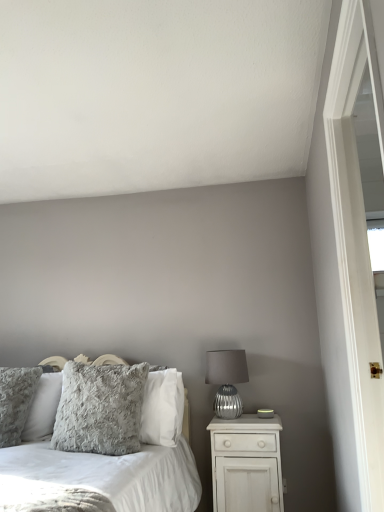
Question: Does fluffy gray pillow at left, arranged as the second pillow when viewed from the right, turn towards matte silver glass table lamp at right?

Choices:
 (A) yes
 (B) no

Answer: (B)

Question: Is the position of fluffy gray pillow at left, arranged as the second pillow when viewed from the right, less distant than that of matte silver glass table lamp at right?

Choices:
 (A) no
 (B) yes

Answer: (B)

Question: Does fluffy gray pillow at left, arranged as the second pillow when viewed from the right, have a larger size compared to matte silver glass table lamp at right?

Choices:
 (A) yes
 (B) no

Answer: (A)

Question: Is matte silver glass table lamp at right surrounded by fluffy gray pillow at left, arranged as the second pillow when viewed from the right?

Choices:
 (A) yes
 (B) no

Answer: (B)

Question: Does fluffy gray pillow at left, which is counted as the 1th pillow, starting from the left, come behind matte silver glass table lamp at right?

Choices:
 (A) yes
 (B) no

Answer: (B)

Question: Considering the relative sizes of fluffy gray pillow at left, which is counted as the 1th pillow, starting from the left, and matte silver glass table lamp at right in the image provided, is fluffy gray pillow at left, which is counted as the 1th pillow, starting from the left, thinner than matte silver glass table lamp at right?

Choices:
 (A) no
 (B) yes

Answer: (B)

Question: Is matte silver glass table lamp at right closer to camera compared to fluffy gray pillow at left, arranged as the second pillow when viewed from the right?

Choices:
 (A) yes
 (B) no

Answer: (B)

Question: Is matte silver glass table lamp at right positioned behind fluffy gray pillow at left, which is counted as the 1th pillow, starting from the left?

Choices:
 (A) yes
 (B) no

Answer: (A)

Question: Is matte silver glass table lamp at right thinner than fluffy gray pillow at left, which is counted as the 1th pillow, starting from the left?

Choices:
 (A) yes
 (B) no

Answer: (B)

Question: Can you confirm if matte silver glass table lamp at right is bigger than fluffy gray pillow at left, arranged as the second pillow when viewed from the right?

Choices:
 (A) no
 (B) yes

Answer: (A)

Question: Is matte silver glass table lamp at right not close to fluffy gray pillow at left, which is counted as the 1th pillow, starting from the left?

Choices:
 (A) no
 (B) yes

Answer: (B)

Question: Is matte silver glass table lamp at right oriented towards fluffy gray pillow at left, arranged as the second pillow when viewed from the right?

Choices:
 (A) yes
 (B) no

Answer: (B)

Question: Is fluffy gray pillow at left, which is counted as the 1th pillow, starting from the left, taller than white matte nightstand at lower right?

Choices:
 (A) no
 (B) yes

Answer: (B)